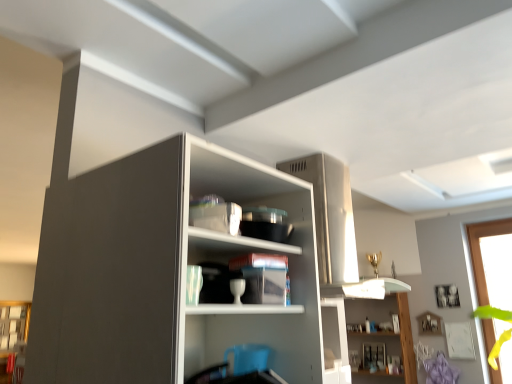
Question: From a real-world perspective, relative to white glossy shelf at upper center, acting as the second shelf starting from the front, is transparent glass window at right vertically above or below?

Choices:
 (A) below
 (B) above

Answer: (B)

Question: Considering the positions of transparent glass window at right and white glossy shelf at upper center, the 2th shelf from the left, in the image, is transparent glass window at right wider or thinner than white glossy shelf at upper center, the 2th shelf from the left,?

Choices:
 (A) wide
 (B) thin

Answer: (A)

Question: Estimate the real-world distances between objects in this image. Which object is farther from the transparent glass window at right?

Choices:
 (A) matte cardboard box at center, which ranks as the 1th shelf in front-to-back order
 (B) white glossy shelf at upper center, the 1th shelf ordered from the bottom

Answer: (A)

Question: Estimate the real-world distances between objects in this image. Which object is closer to the transparent glass window at right?

Choices:
 (A) white glossy shelf at upper center, arranged as the second shelf when viewed from the top
 (B) matte cardboard box at center, which is the first shelf from top to bottom

Answer: (A)